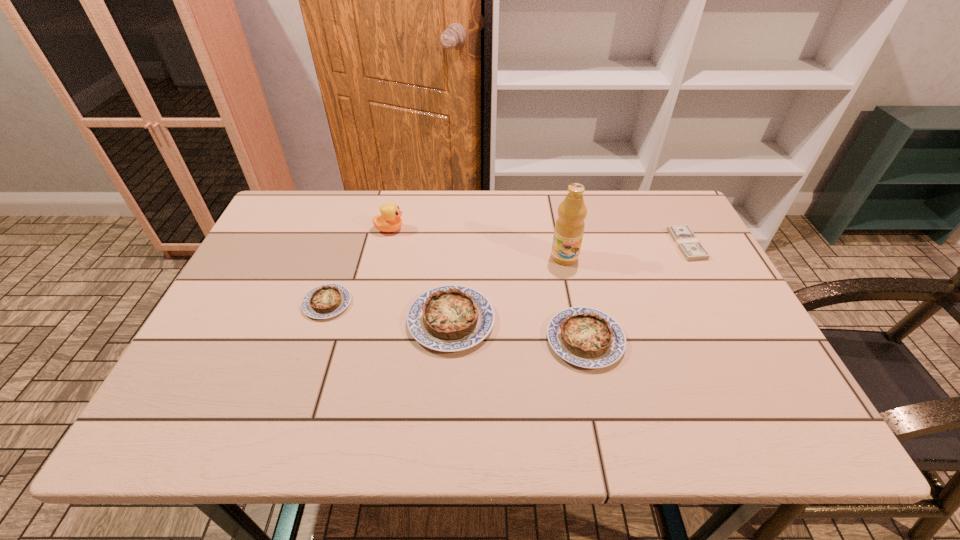
In order to click on free spot that satisfies the following two spatial constraints: 1. on the face of the duckling; 2. on the front side of the leftmost object in this screenshot , I will do `click(372, 303)`.

The width and height of the screenshot is (960, 540). What are the coordinates of `free point that satisfies the following two spatial constraints: 1. on the front side of the third object from left to right; 2. on the left side of the leftmost object` in the screenshot? It's located at (322, 321).

Locate an element on the screen. vacant space that satisfies the following two spatial constraints: 1. on the face of the fifth object from right to left; 2. on the left side of the rightmost object is located at coordinates (386, 244).

I want to click on vacant point that satisfies the following two spatial constraints: 1. on the front side of the second quiche from right to left; 2. on the left side of the rightmost quiche, so click(450, 340).